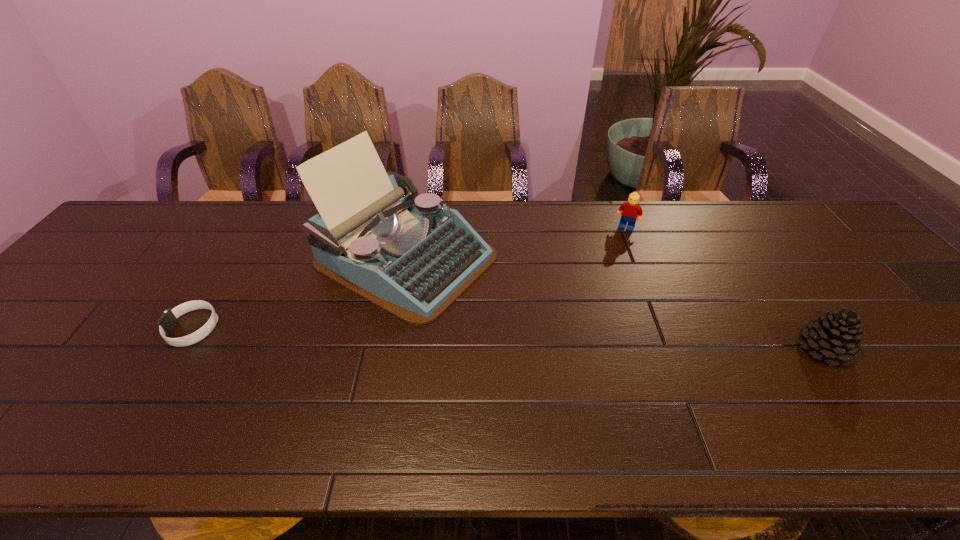
The height and width of the screenshot is (540, 960). Find the location of `vacant space on the desktop that is between the shortest object and the rightmost object and is positioned on the typing side of the third object from right to left`. vacant space on the desktop that is between the shortest object and the rightmost object and is positioned on the typing side of the third object from right to left is located at coordinates (574, 341).

Find the location of a particular element. vacant spot on the desktop that is between the wristband and the pinecone and is positioned on the front-facing side of the Lego is located at coordinates (575, 341).